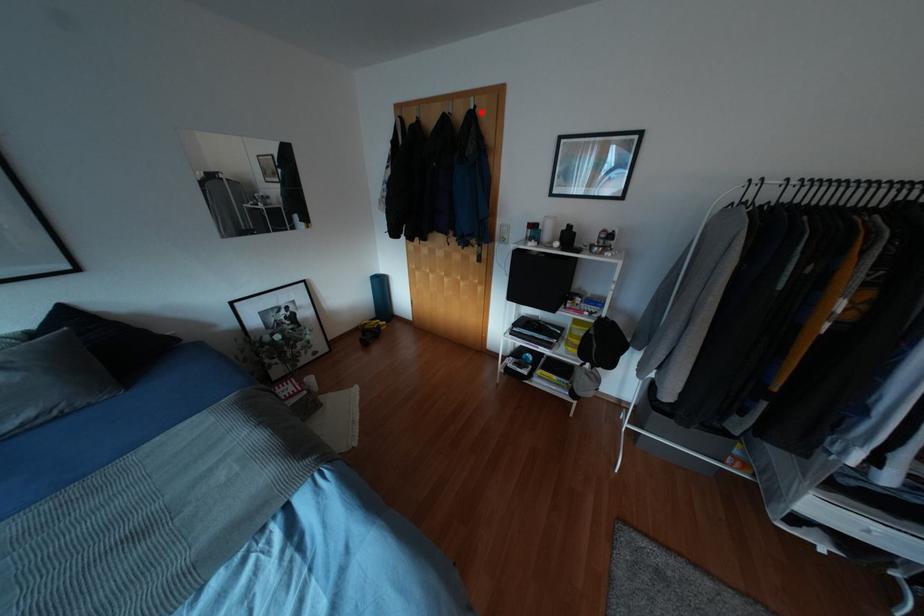
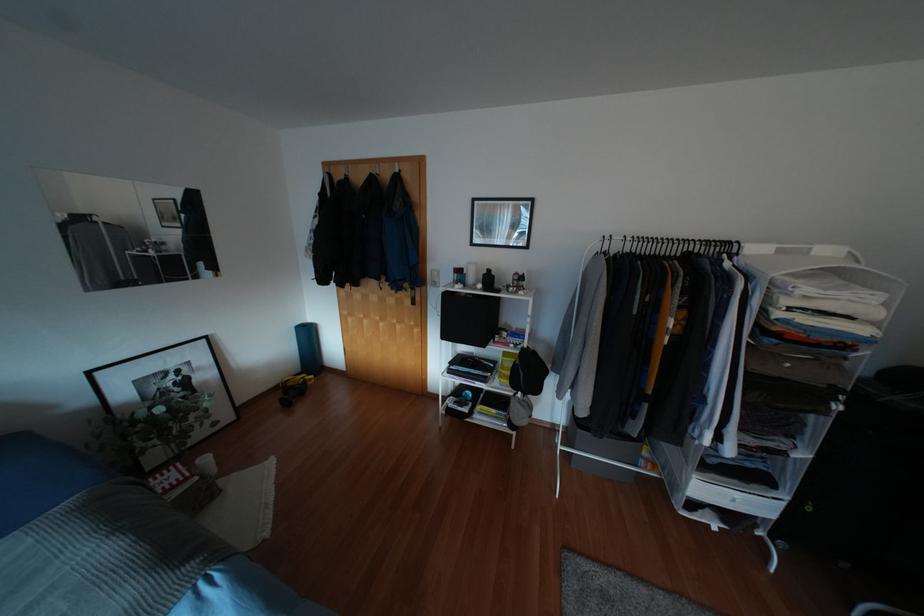
Locate, in the second image, the point that corresponds to the highlighted location in the first image.

(406, 176)